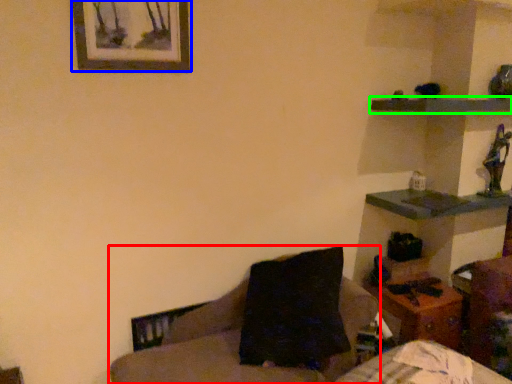
Question: Which is farther away from furniture (highlighted by a red box)? picture frame (highlighted by a blue box) or shelf (highlighted by a green box)?

Choices:
 (A) picture frame
 (B) shelf

Answer: (B)